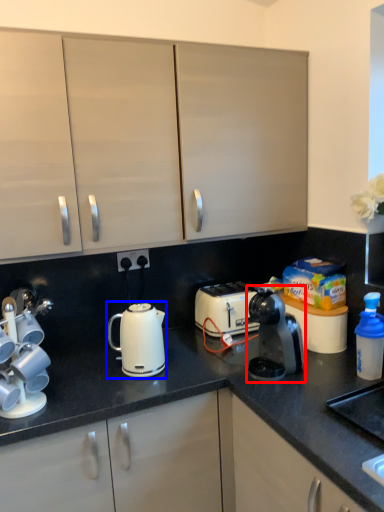
Question: Which point is further to the camera, home appliance (highlighted by a red box) or kettle (highlighted by a blue box)?

Choices:
 (A) home appliance
 (B) kettle

Answer: (B)